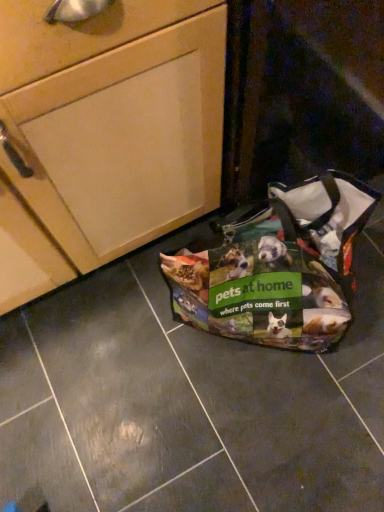
Question: Considering the relative positions of printed fabric pet carrier at lower right and matte wood cabinet at upper left in the image provided, is printed fabric pet carrier at lower right to the left of matte wood cabinet at upper left from the viewer's perspective?

Choices:
 (A) no
 (B) yes

Answer: (A)

Question: Can you confirm if printed fabric pet carrier at lower right is bigger than matte wood cabinet at upper left?

Choices:
 (A) yes
 (B) no

Answer: (B)

Question: Is the surface of printed fabric pet carrier at lower right in direct contact with matte wood cabinet at upper left?

Choices:
 (A) no
 (B) yes

Answer: (A)

Question: Can we say printed fabric pet carrier at lower right lies outside matte wood cabinet at upper left?

Choices:
 (A) yes
 (B) no

Answer: (A)

Question: From a real-world perspective, is printed fabric pet carrier at lower right over matte wood cabinet at upper left?

Choices:
 (A) no
 (B) yes

Answer: (A)

Question: Can you confirm if printed fabric pet carrier at lower right is smaller than matte wood cabinet at upper left?

Choices:
 (A) no
 (B) yes

Answer: (B)

Question: Can you confirm if matte wood cabinet at upper left is shorter than printed fabric pet carrier at lower right?

Choices:
 (A) no
 (B) yes

Answer: (A)

Question: Could you tell me if matte wood cabinet at upper left is turned towards printed fabric pet carrier at lower right?

Choices:
 (A) yes
 (B) no

Answer: (A)

Question: Is matte wood cabinet at upper left wider than printed fabric pet carrier at lower right?

Choices:
 (A) yes
 (B) no

Answer: (A)

Question: Is matte wood cabinet at upper left in front of printed fabric pet carrier at lower right?

Choices:
 (A) no
 (B) yes

Answer: (B)

Question: From a real-world perspective, is matte wood cabinet at upper left below printed fabric pet carrier at lower right?

Choices:
 (A) no
 (B) yes

Answer: (A)

Question: From a real-world perspective, is matte wood cabinet at upper left over printed fabric pet carrier at lower right?

Choices:
 (A) no
 (B) yes

Answer: (B)

Question: Based on their sizes in the image, would you say printed fabric pet carrier at lower right is bigger or smaller than matte wood cabinet at upper left?

Choices:
 (A) small
 (B) big

Answer: (A)